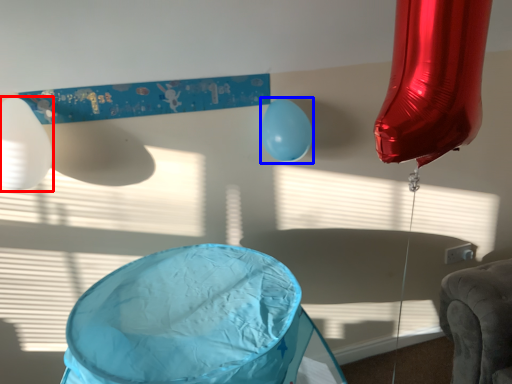
Question: Among these objects, which one is nearest to the camera, balloon (highlighted by a red box) or balloon (highlighted by a blue box)?

Choices:
 (A) balloon
 (B) balloon

Answer: (A)